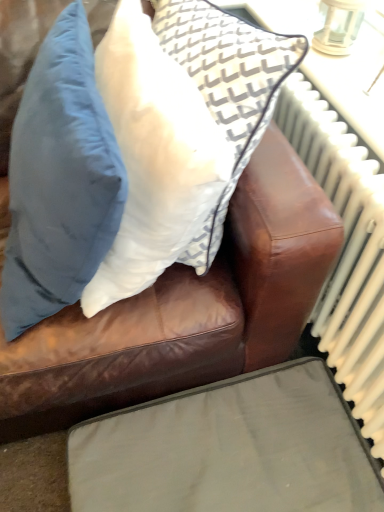
How much space does matte blue pillow at upper left, placed as the 2th pillow when sorted from right to left, occupy horizontally?

It is 10.05 inches.

The width and height of the screenshot is (384, 512). What do you see at coordinates (345, 251) in the screenshot? I see `white metallic radiator at right` at bounding box center [345, 251].

In order to face matte gray cushion at lower center, should I rotate leftwards or rightwards?

You should look right and rotate roughly 3.029 degrees.

Find the location of a particular element. The width and height of the screenshot is (384, 512). white fabric pillow at upper center, the first pillow viewed from the right is located at coordinates (153, 157).

Measure the distance between point (104, 41) and camera.

The distance of point (104, 41) from camera is 73.80 centimeters.

This screenshot has height=512, width=384. I want to click on matte blue pillow at upper left, placed as the 2th pillow when sorted from right to left, so (60, 179).

Between matte gray cushion at lower center and white metallic radiator at right, which one appears on the left side from the viewer's perspective?

From the viewer's perspective, matte gray cushion at lower center appears more on the left side.

Does matte gray cushion at lower center have a smaller size compared to white metallic radiator at right?

No, matte gray cushion at lower center is not smaller than white metallic radiator at right.

From the image's perspective, is matte gray cushion at lower center located above white metallic radiator at right?

No, from the image's perspective, matte gray cushion at lower center is not above white metallic radiator at right.

Considering the positions of point (297, 458) and point (338, 265), is point (297, 458) closer or farther from the camera than point (338, 265)?

Point (297, 458) is positioned closer to the camera compared to point (338, 265).

Does point (89, 62) come closer to viewer compared to point (339, 174)?

That is True.

Could you tell me if matte blue pillow at upper left, placed as the 2th pillow when sorted from right to left, is facing white metallic radiator at right?

No, matte blue pillow at upper left, placed as the 2th pillow when sorted from right to left, is not turned towards white metallic radiator at right.

Considering the positions of objects matte blue pillow at upper left, placed as the 2th pillow when sorted from right to left, and white metallic radiator at right in the image provided, who is more to the right, matte blue pillow at upper left, placed as the 2th pillow when sorted from right to left, or white metallic radiator at right?

Positioned to the right is white metallic radiator at right.

Image resolution: width=384 pixels, height=512 pixels. In order to click on furniture lying below the white fabric pillow at upper center, which is counted as the 2th pillow, starting from the left (from the image's perspective) in this screenshot , I will do `click(229, 449)`.

From a real-world perspective, is matte gray cushion at lower center above or below white fabric pillow at upper center, the first pillow viewed from the right?

Clearly, from a real-world perspective, matte gray cushion at lower center is below white fabric pillow at upper center, the first pillow viewed from the right.

Locate an element on the screen. This screenshot has height=512, width=384. furniture below the matte blue pillow at upper left, placed as the 2th pillow when sorted from right to left (from the image's perspective) is located at coordinates (229, 449).

Which object is further away from the camera, matte blue pillow at upper left, placed as the 2th pillow when sorted from right to left, or matte gray cushion at lower center?

matte gray cushion at lower center is further from the camera.

What's the angular difference between matte blue pillow at upper left, the first pillow from the left, and matte gray cushion at lower center's facing directions?

The angle between the facing direction of matte blue pillow at upper left, the first pillow from the left, and the facing direction of matte gray cushion at lower center is 4.01 degrees.

From a real-world perspective, is matte blue pillow at upper left, placed as the 2th pillow when sorted from right to left, over white fabric pillow at upper center, which is counted as the 2th pillow, starting from the left?

No, from a real-world perspective, matte blue pillow at upper left, placed as the 2th pillow when sorted from right to left, is not above white fabric pillow at upper center, which is counted as the 2th pillow, starting from the left.

Is matte blue pillow at upper left, placed as the 2th pillow when sorted from right to left, far from white fabric pillow at upper center, the first pillow viewed from the right?

No.

Based on the photo, can you tell me how much matte blue pillow at upper left, the first pillow from the left, and white fabric pillow at upper center, the first pillow viewed from the right, differ in facing direction?

The angular difference between matte blue pillow at upper left, the first pillow from the left, and white fabric pillow at upper center, the first pillow viewed from the right, is 16.4 degrees.

Locate an element on the screen. pillow on the right of matte blue pillow at upper left, placed as the 2th pillow when sorted from right to left is located at coordinates point(153,157).

From a real-world perspective, is white fabric pillow at upper center, which is counted as the 2th pillow, starting from the left, on white metallic radiator at right?

Correct, in the physical world, white fabric pillow at upper center, which is counted as the 2th pillow, starting from the left, is higher than white metallic radiator at right.

Which of these two, white fabric pillow at upper center, which is counted as the 2th pillow, starting from the left, or white metallic radiator at right, is wider?

white fabric pillow at upper center, which is counted as the 2th pillow, starting from the left.

Looking at this image, in the image, is white metallic radiator at right positioned in front of or behind matte gray cushion at lower center?

Visually, white metallic radiator at right is located in front of matte gray cushion at lower center.

How far apart are white metallic radiator at right and matte gray cushion at lower center?

white metallic radiator at right and matte gray cushion at lower center are 12.60 inches apart.

Locate an element on the screen. furniture that appears below the white metallic radiator at right (from the image's perspective) is located at coordinates (229, 449).

Is white metallic radiator at right facing away from matte gray cushion at lower center?

No, white metallic radiator at right is not facing away from matte gray cushion at lower center.

Identify the location of radiator in front of the matte gray cushion at lower center. (345, 251).

Image resolution: width=384 pixels, height=512 pixels. I want to click on the 2nd pillow counting from the left side of the white metallic radiator at right, so click(60, 179).

Based on the photo, when comparing their distances from white fabric pillow at upper center, the first pillow viewed from the right, does matte blue pillow at upper left, the first pillow from the left, or white metallic radiator at right seem further?

Based on the image, white metallic radiator at right appears to be further to white fabric pillow at upper center, the first pillow viewed from the right.

Which object lies nearer to the anchor point white fabric pillow at upper center, the first pillow viewed from the right, matte gray cushion at lower center or white metallic radiator at right?

Based on the image, white metallic radiator at right appears to be nearer to white fabric pillow at upper center, the first pillow viewed from the right.

Which object lies nearer to the anchor point white metallic radiator at right, white fabric pillow at upper center, the first pillow viewed from the right, or matte blue pillow at upper left, placed as the 2th pillow when sorted from right to left?

white fabric pillow at upper center, the first pillow viewed from the right, lies closer to white metallic radiator at right than the other object.

Considering their positions, is white fabric pillow at upper center, the first pillow viewed from the right, positioned closer to matte blue pillow at upper left, placed as the 2th pillow when sorted from right to left, than white metallic radiator at right?

white fabric pillow at upper center, the first pillow viewed from the right, is positioned closer to the anchor matte blue pillow at upper left, placed as the 2th pillow when sorted from right to left.

Which object lies further to the anchor point white metallic radiator at right, matte gray cushion at lower center or matte blue pillow at upper left, placed as the 2th pillow when sorted from right to left?

Among the two, matte blue pillow at upper left, placed as the 2th pillow when sorted from right to left, is located further to white metallic radiator at right.

From the picture: Based on their spatial positions, is matte gray cushion at lower center or white fabric pillow at upper center, which is counted as the 2th pillow, starting from the left, further from white metallic radiator at right?

white fabric pillow at upper center, which is counted as the 2th pillow, starting from the left, lies further to white metallic radiator at right than the other object.

Estimate the real-world distances between objects in this image. Which object is closer to matte blue pillow at upper left, placed as the 2th pillow when sorted from right to left, white metallic radiator at right or matte gray cushion at lower center?

The object closer to matte blue pillow at upper left, placed as the 2th pillow when sorted from right to left, is white metallic radiator at right.

When comparing their distances from white fabric pillow at upper center, which is counted as the 2th pillow, starting from the left, does matte gray cushion at lower center or matte blue pillow at upper left, placed as the 2th pillow when sorted from right to left, seem further?

Among the two, matte gray cushion at lower center is located further to white fabric pillow at upper center, which is counted as the 2th pillow, starting from the left.

Where is `radiator that lies between white fabric pillow at upper center, which is counted as the 2th pillow, starting from the left, and matte gray cushion at lower center from top to bottom`? The width and height of the screenshot is (384, 512). radiator that lies between white fabric pillow at upper center, which is counted as the 2th pillow, starting from the left, and matte gray cushion at lower center from top to bottom is located at coordinates (345, 251).

The height and width of the screenshot is (512, 384). What are the coordinates of `pillow situated between matte blue pillow at upper left, placed as the 2th pillow when sorted from right to left, and white metallic radiator at right from left to right` in the screenshot? It's located at (153, 157).

Where is `pillow that lies between white fabric pillow at upper center, the first pillow viewed from the right, and matte gray cushion at lower center from top to bottom`? pillow that lies between white fabric pillow at upper center, the first pillow viewed from the right, and matte gray cushion at lower center from top to bottom is located at coordinates (60, 179).

Find the location of `radiator that lies between matte blue pillow at upper left, placed as the 2th pillow when sorted from right to left, and matte gray cushion at lower center from top to bottom`. radiator that lies between matte blue pillow at upper left, placed as the 2th pillow when sorted from right to left, and matte gray cushion at lower center from top to bottom is located at coordinates (345, 251).